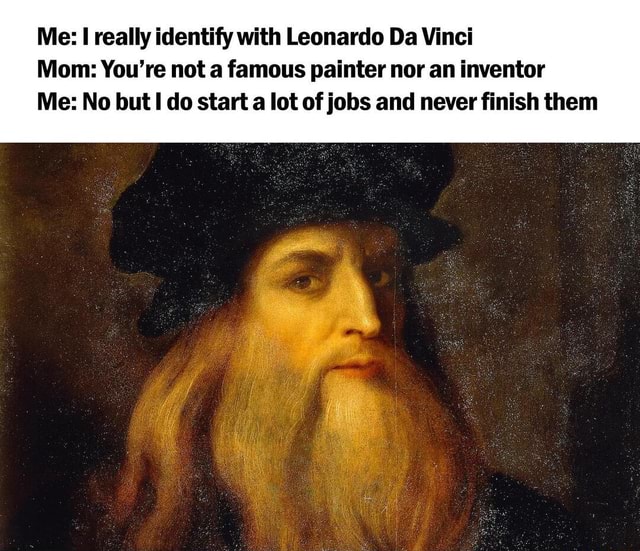
Image resolution: width=640 pixels, height=551 pixels. I want to click on wall, so click(x=525, y=342).